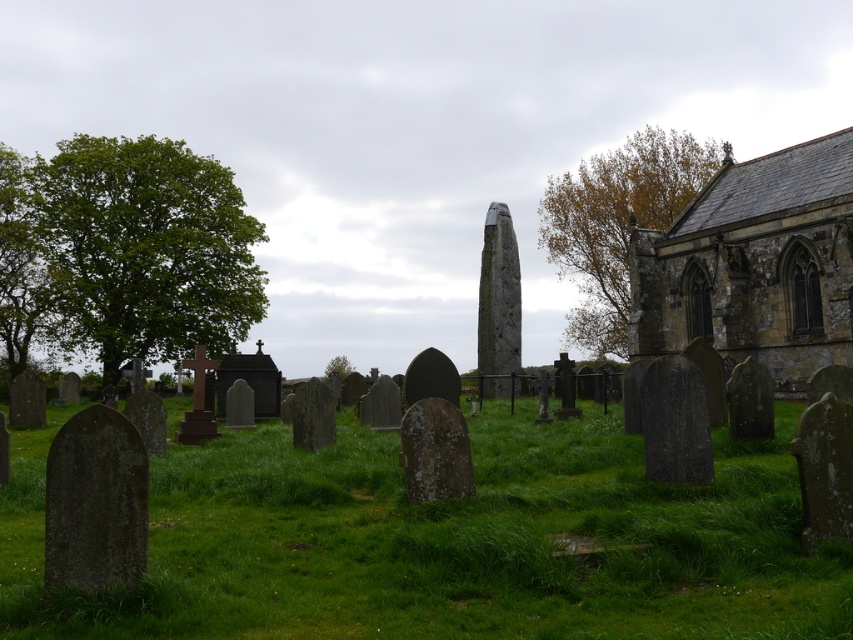
You are a gardener planning to mow the green grassy at center and trim the green leafy tree at center. Which area requires more attention in terms of width?

The green grassy at center requires more attention in terms of width because its width surpasses that of the green leafy tree at center.